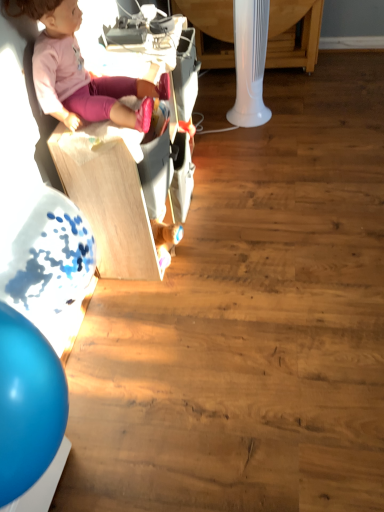
What do you see at coordinates (109, 197) in the screenshot?
I see `wooden toy box at upper left` at bounding box center [109, 197].

What do you see at coordinates (294, 34) in the screenshot? Image resolution: width=384 pixels, height=512 pixels. I see `white plastic table at upper center` at bounding box center [294, 34].

Find the location of `pink fabric doll at upper left`. pink fabric doll at upper left is located at coordinates (81, 73).

In order to click on wooden toy box at upper left in this screenshot , I will do `click(109, 197)`.

Identify the location of furniture lying on the left of white plastic table at upper center. (109, 197).

In terms of width, does white plastic table at upper center look wider or thinner when compared to wooden toy box at upper left?

white plastic table at upper center is wider than wooden toy box at upper left.

Could you tell me if white plastic table at upper center is turned towards wooden toy box at upper left?

Yes.

Which is behind, white plastic table at upper center or wooden toy box at upper left?

white plastic table at upper center is behind.

Does wooden toy box at upper left touch white plastic table at upper center?

wooden toy box at upper left and white plastic table at upper center are not in contact.

Could you tell me if wooden toy box at upper left is turned towards white plastic table at upper center?

No, wooden toy box at upper left is not oriented towards white plastic table at upper center.

From a real-world perspective, relative to white plastic table at upper center, is wooden toy box at upper left vertically above or below?

wooden toy box at upper left is situated higher than white plastic table at upper center in the real world.

From the image's perspective, is wooden toy box at upper left under white plastic table at upper center?

Correct, wooden toy box at upper left appears lower than white plastic table at upper center in the image.

Locate an element on the screen. person on the left of white plastic table at upper center is located at coordinates (81, 73).

From a real-world perspective, between white plastic table at upper center and pink fabric doll at upper left, who is vertically higher?

pink fabric doll at upper left, from a real-world perspective.

In the scene shown: Can you confirm if white plastic table at upper center is shorter than pink fabric doll at upper left?

No.

Is white plastic table at upper center at the right side of pink fabric doll at upper left?

Correct, you'll find white plastic table at upper center to the right of pink fabric doll at upper left.

Is pink fabric doll at upper left located outside wooden toy box at upper left?

Absolutely, pink fabric doll at upper left is external to wooden toy box at upper left.

Does pink fabric doll at upper left come in front of wooden toy box at upper left?

Yes, it is in front of wooden toy box at upper left.

Is pink fabric doll at upper left bigger than wooden toy box at upper left?

No.

From the image's perspective, which one is positioned lower, pink fabric doll at upper left or wooden toy box at upper left?

wooden toy box at upper left, from the image's perspective.

Could white plastic table at upper center be considered to be inside pink fabric doll at upper left?

Actually, white plastic table at upper center is outside pink fabric doll at upper left.

Can you tell me how much pink fabric doll at upper left and white plastic table at upper center differ in facing direction?

The angle between the facing direction of pink fabric doll at upper left and the facing direction of white plastic table at upper center is 88.8 degrees.

Between pink fabric doll at upper left and white plastic table at upper center, which one has larger width?

With larger width is white plastic table at upper center.

Where is `table that is on the right side of pink fabric doll at upper left`? The width and height of the screenshot is (384, 512). table that is on the right side of pink fabric doll at upper left is located at coordinates (294, 34).

Is wooden toy box at upper left wider than pink fabric doll at upper left?

No, wooden toy box at upper left is not wider than pink fabric doll at upper left.

Which is in front, wooden toy box at upper left or pink fabric doll at upper left?

pink fabric doll at upper left is in front.

Which of these two, wooden toy box at upper left or pink fabric doll at upper left, stands shorter?

pink fabric doll at upper left is shorter.

Find the location of a particular element. Image resolution: width=384 pixels, height=512 pixels. furniture in front of the white plastic table at upper center is located at coordinates pyautogui.click(x=109, y=197).

Find the location of a particular element. The width and height of the screenshot is (384, 512). table lying above the wooden toy box at upper left (from the image's perspective) is located at coordinates (294, 34).

When comparing their distances from pink fabric doll at upper left, does white plastic table at upper center or wooden toy box at upper left seem closer?

wooden toy box at upper left is positioned closer to the anchor pink fabric doll at upper left.

From the image, which object appears to be nearer to white plastic table at upper center, wooden toy box at upper left or pink fabric doll at upper left?

Based on the image, wooden toy box at upper left appears to be nearer to white plastic table at upper center.

Estimate the real-world distances between objects in this image. Which object is closer to white plastic table at upper center, pink fabric doll at upper left or wooden toy box at upper left?

A: wooden toy box at upper left lies closer to white plastic table at upper center than the other object.

Based on their spatial positions, is white plastic table at upper center or pink fabric doll at upper left further from wooden toy box at upper left?

Among the two, white plastic table at upper center is located further to wooden toy box at upper left.

Which object lies nearer to the anchor point wooden toy box at upper left, pink fabric doll at upper left or white plastic table at upper center?

pink fabric doll at upper left is positioned closer to the anchor wooden toy box at upper left.

Looking at the image, which one is located closer to pink fabric doll at upper left, wooden toy box at upper left or white plastic table at upper center?

wooden toy box at upper left is closer to pink fabric doll at upper left.

Where is `furniture between pink fabric doll at upper left and white plastic table at upper center from front to back`? The height and width of the screenshot is (512, 384). furniture between pink fabric doll at upper left and white plastic table at upper center from front to back is located at coordinates (109, 197).